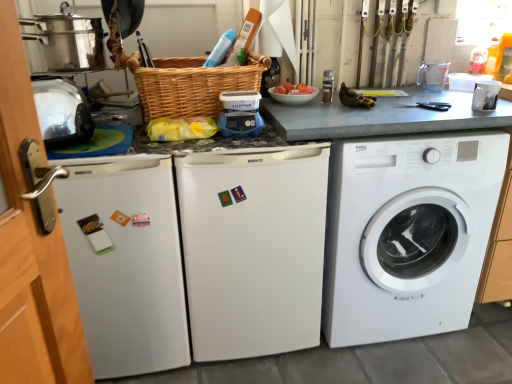
Question: Should I look upward or downward to see blue plastic scale at center, the 2th appliance positioned from the left?

Choices:
 (A) up
 (B) down

Answer: (A)

Question: Is blue plastic scale at center, the third appliance positioned from the right, oriented towards white matte dishwasher at left, placed as the first dish washer when sorted from left to right?

Choices:
 (A) yes
 (B) no

Answer: (B)

Question: From the image's perspective, is blue plastic scale at center, the 2th appliance positioned from the left, on white matte dishwasher at left, placed as the 2th dish washer when sorted from right to left?

Choices:
 (A) no
 (B) yes

Answer: (B)

Question: Considering the relative sizes of blue plastic scale at center, the third appliance positioned from the right, and white matte dishwasher at left, placed as the 2th dish washer when sorted from right to left, in the image provided, is blue plastic scale at center, the third appliance positioned from the right, shorter than white matte dishwasher at left, placed as the 2th dish washer when sorted from right to left,?

Choices:
 (A) no
 (B) yes

Answer: (B)

Question: Does blue plastic scale at center, the 2th appliance positioned from the left, have a smaller size compared to white matte dishwasher at left, placed as the 2th dish washer when sorted from right to left?

Choices:
 (A) no
 (B) yes

Answer: (B)

Question: Considering the relative positions of blue plastic scale at center, the 2th appliance positioned from the left, and white matte dishwasher at left, placed as the first dish washer when sorted from left to right, in the image provided, is blue plastic scale at center, the 2th appliance positioned from the left, to the left of white matte dishwasher at left, placed as the first dish washer when sorted from left to right, from the viewer's perspective?

Choices:
 (A) yes
 (B) no

Answer: (B)

Question: Can you confirm if blue plastic scale at center, the third appliance positioned from the right, is taller than white matte dishwasher at left, placed as the first dish washer when sorted from left to right?

Choices:
 (A) no
 (B) yes

Answer: (A)

Question: Is woven brown basket at center bigger than white matte dishwasher at left, placed as the first dish washer when sorted from left to right?

Choices:
 (A) no
 (B) yes

Answer: (A)

Question: Is woven brown basket at center smaller than white matte dishwasher at left, placed as the first dish washer when sorted from left to right?

Choices:
 (A) yes
 (B) no

Answer: (A)

Question: Is white matte dishwasher at left, placed as the first dish washer when sorted from left to right, inside woven brown basket at center?

Choices:
 (A) yes
 (B) no

Answer: (B)

Question: Is woven brown basket at center outside of white matte dishwasher at left, placed as the first dish washer when sorted from left to right?

Choices:
 (A) no
 (B) yes

Answer: (B)

Question: Can you confirm if woven brown basket at center is thinner than white matte dishwasher at left, placed as the first dish washer when sorted from left to right?

Choices:
 (A) no
 (B) yes

Answer: (B)

Question: From a real-world perspective, is woven brown basket at center under white matte dishwasher at left, placed as the 2th dish washer when sorted from right to left?

Choices:
 (A) yes
 (B) no

Answer: (B)

Question: Is white glossy mug at upper right, arranged as the fourth appliance when viewed from the left, aimed at white matte dishwasher at center, which ranks as the second dish washer in left-to-right order?

Choices:
 (A) yes
 (B) no

Answer: (B)